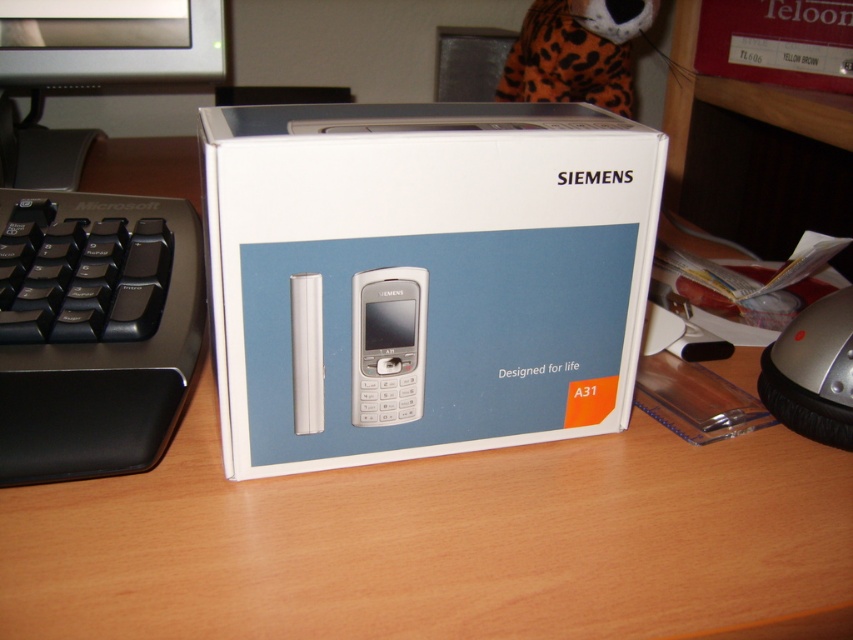
You are setting up a workstation and need to place the black plastic keyboard at left and the black plastic monitor at upper left. Based on their sizes, which one requires more desk space?

The black plastic monitor at upper left requires more desk space because it is larger than the black plastic keyboard at left.

You are organizing a desk and need to stack items vertically. You have the white cardboard box at center and the black plastic monitor at upper left. Which item should you place at the bottom of the stack to ensure stability?

The white cardboard box at center has a greater height compared to the black plastic monitor at upper left, so placing the taller white cardboard box at center at the bottom would provide a more stable base for the stack.